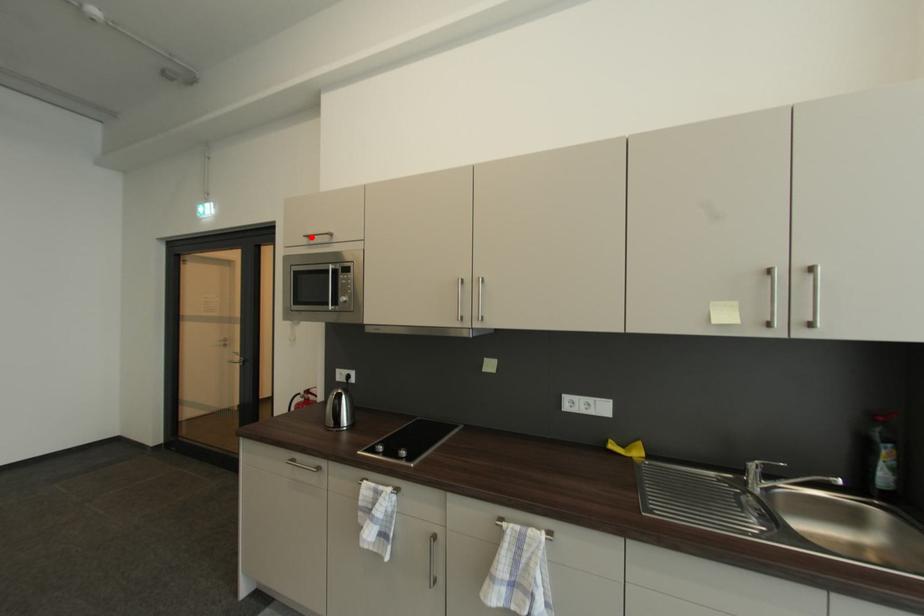
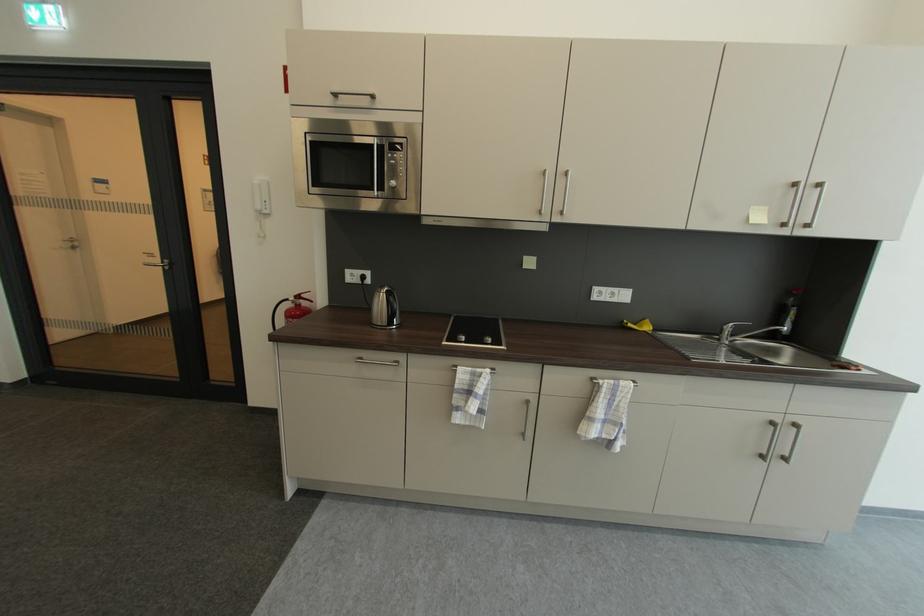
Where in the second image is the point corresponding to the highlighted location from the first image?

(337, 95)